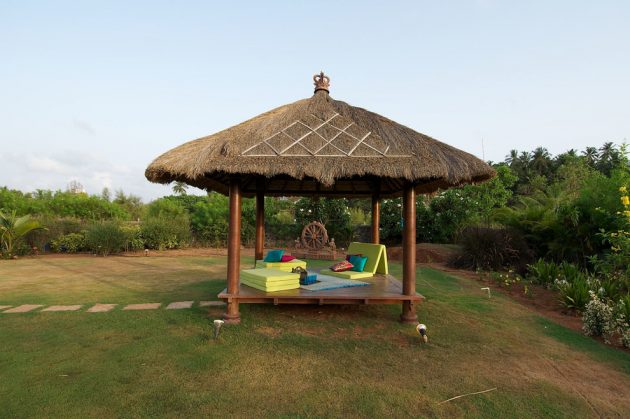
Find the location of `rug`. rug is located at coordinates (328, 284).